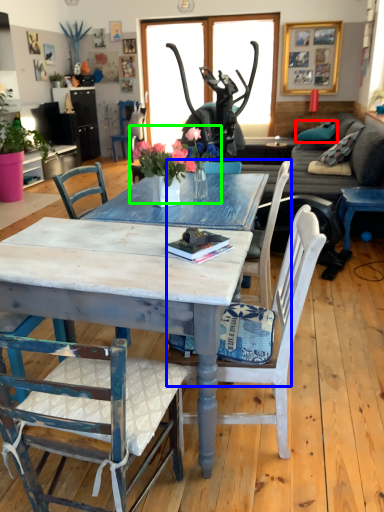
Question: Which object is positioned farthest from pillow (highlighted by a red box)? Select from chair (highlighted by a blue box) and floral arrangement (highlighted by a green box).

Choices:
 (A) chair
 (B) floral arrangement

Answer: (B)